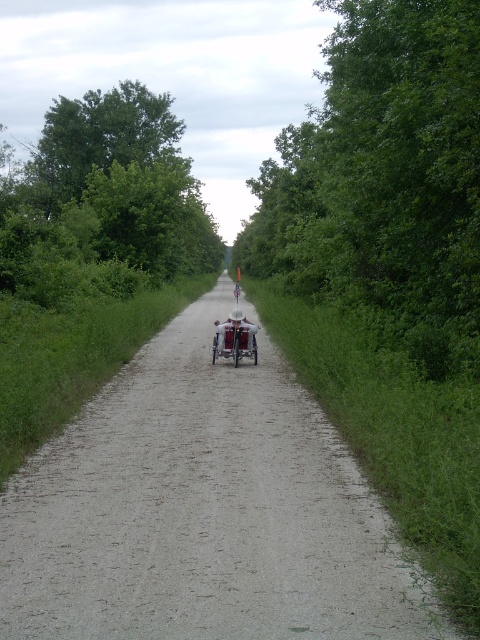
Is green leafy tree at left taller than metallic silver baby carriage at center?

Yes, green leafy tree at left is taller than metallic silver baby carriage at center.

Between point (120, 124) and point (233, 330), which one is positioned behind?

The point (120, 124) is more distant.

Describe the element at coordinates (104, 202) in the screenshot. The width and height of the screenshot is (480, 640). I see `green leafy tree at left` at that location.

Where is `green leafy tree at left`? This screenshot has width=480, height=640. green leafy tree at left is located at coordinates (104, 202).

Does point (455, 144) lie in front of point (36, 173)?

That is True.

The width and height of the screenshot is (480, 640). What are the coordinates of `green leafy tree at center` in the screenshot? It's located at (384, 177).

Is point (173, 342) closer to camera compared to point (272, 236)?

Yes, point (173, 342) is in front of point (272, 236).

Is gray gravel path at center above green leafy tree at center?

Actually, gray gravel path at center is below green leafy tree at center.

Is point (155, 566) positioned before point (432, 61)?

Yes, it is in front of point (432, 61).

In order to click on gray gravel path at center in this screenshot , I will do `click(204, 512)`.